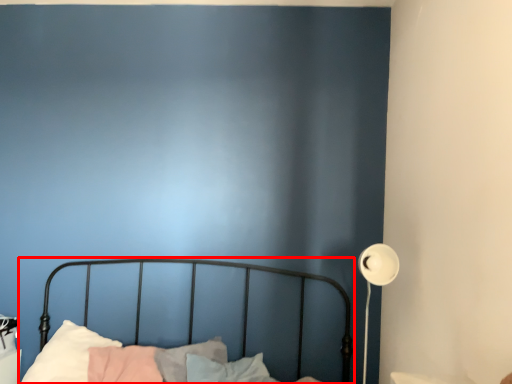
Question: From the image's perspective, what is the correct spatial relationship of bed (annotated by the red box) in relation to lamp?

Choices:
 (A) above
 (B) below

Answer: (B)